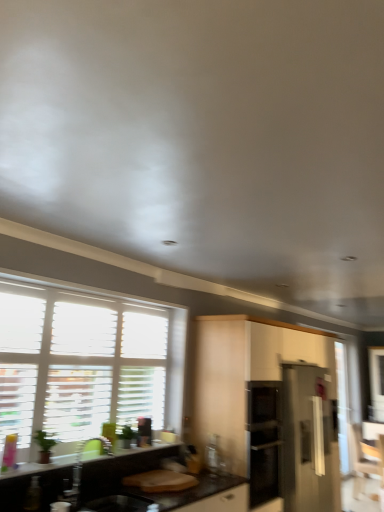
Question: Is satin white cabinet at center not near white wood window at left?

Choices:
 (A) no
 (B) yes

Answer: (A)

Question: Is the depth of satin white cabinet at center greater than that of white wood window at left?

Choices:
 (A) no
 (B) yes

Answer: (B)

Question: From the image's perspective, is satin white cabinet at center located beneath white wood window at left?

Choices:
 (A) yes
 (B) no

Answer: (A)

Question: Is the position of satin white cabinet at center less distant than that of white wood window at left?

Choices:
 (A) no
 (B) yes

Answer: (A)

Question: Does satin white cabinet at center have a larger size compared to white wood window at left?

Choices:
 (A) yes
 (B) no

Answer: (A)

Question: Does satin white cabinet at center have a smaller size compared to white wood window at left?

Choices:
 (A) no
 (B) yes

Answer: (A)

Question: Does wooden armchair at lower right have a lesser width compared to transparent glass screen door at right?

Choices:
 (A) yes
 (B) no

Answer: (B)

Question: Is there a large distance between wooden armchair at lower right and transparent glass screen door at right?

Choices:
 (A) no
 (B) yes

Answer: (A)

Question: From a real-world perspective, is wooden armchair at lower right on top of transparent glass screen door at right?

Choices:
 (A) no
 (B) yes

Answer: (A)

Question: Is wooden armchair at lower right smaller than transparent glass screen door at right?

Choices:
 (A) yes
 (B) no

Answer: (B)

Question: Is wooden armchair at lower right at the left side of transparent glass screen door at right?

Choices:
 (A) no
 (B) yes

Answer: (B)

Question: Is wooden armchair at lower right outside of transparent glass screen door at right?

Choices:
 (A) no
 (B) yes

Answer: (B)

Question: Is satin white cabinet at center to the right of black laminate countertop at lower left from the viewer's perspective?

Choices:
 (A) yes
 (B) no

Answer: (A)